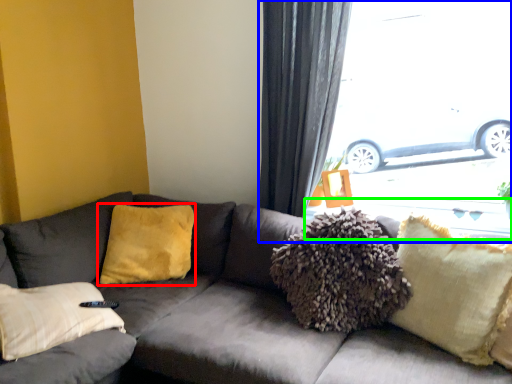
Question: Which object is positioned farthest from pillow (highlighted by a red box)? Select from window (highlighted by a blue box) and window sill (highlighted by a green box).

Choices:
 (A) window
 (B) window sill

Answer: (A)